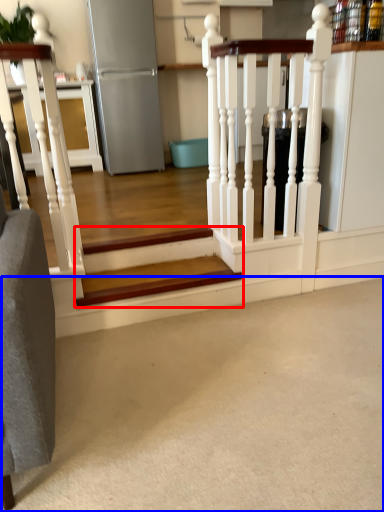
Question: Among these objects, which one is farthest to the camera, stairs (highlighted by a red box) or concrete (highlighted by a blue box)?

Choices:
 (A) stairs
 (B) concrete

Answer: (A)